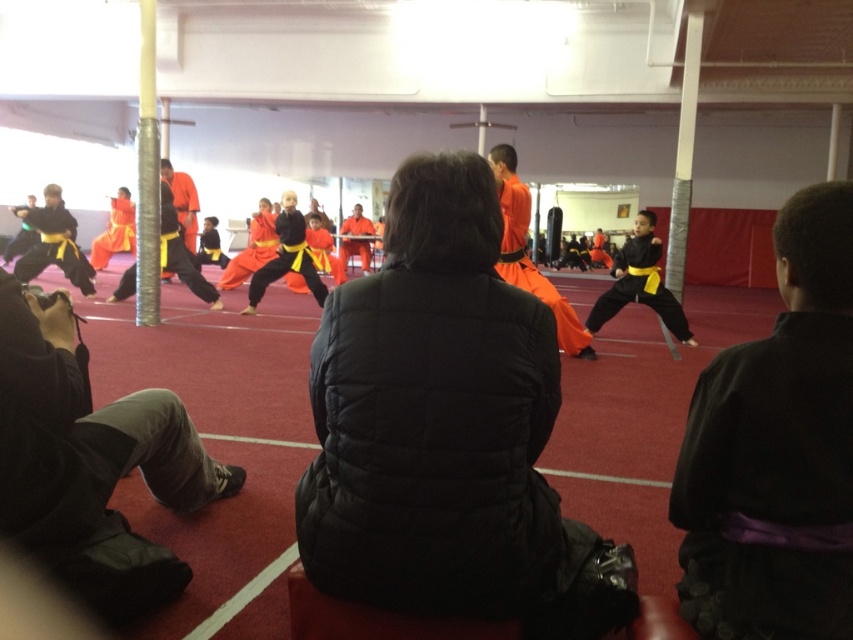
Can you confirm if matte black martial arts uniform at left is taller than orange fabric pants at center?

In fact, matte black martial arts uniform at left may be shorter than orange fabric pants at center.

Which is above, matte black martial arts uniform at left or orange fabric pants at center?

orange fabric pants at center is higher up.

Is point (90, 292) in front of point (132, 228)?

Yes, it is.

The image size is (853, 640). Find the location of `matte black martial arts uniform at left`. matte black martial arts uniform at left is located at coordinates (51, 243).

Is matte orange martial arts uniform at center behind matte black martial arts uniform at center?

That is False.

Between matte orange martial arts uniform at center and matte black martial arts uniform at center, which one appears on the right side from the viewer's perspective?

matte orange martial arts uniform at center is more to the right.

Locate an element on the screen. This screenshot has width=853, height=640. matte orange martial arts uniform at center is located at coordinates (640, 282).

Does black quilted jacket at center appear over matte black martial arts uniform at center?

No.

Is point (489, 420) more distant than point (276, 264)?

No, (489, 420) is in front of (276, 264).

At what (x,y) coordinates should I click in order to perform the action: click on black quilted jacket at center. Please return your answer as a coordinate pair (x, y). The image size is (853, 640). Looking at the image, I should click on (447, 429).